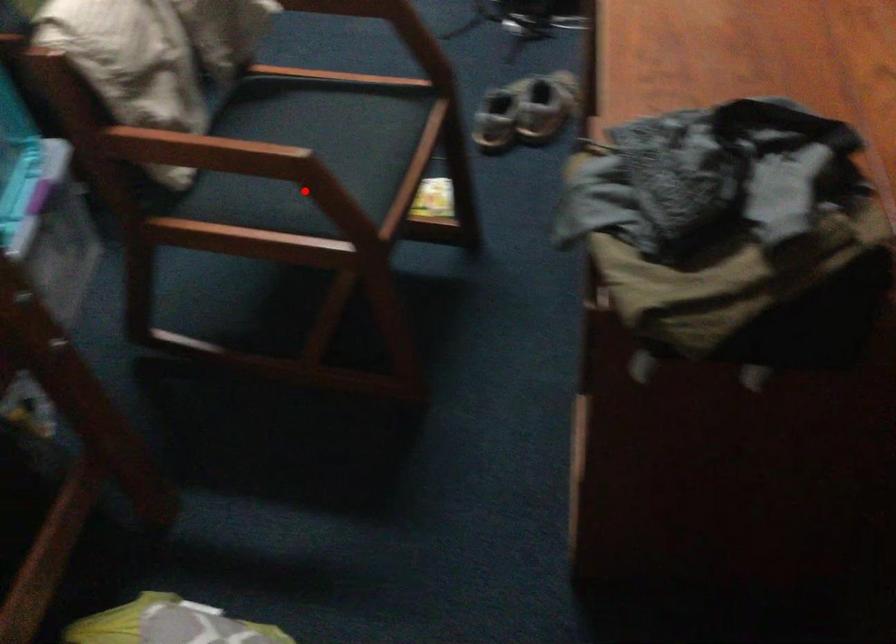
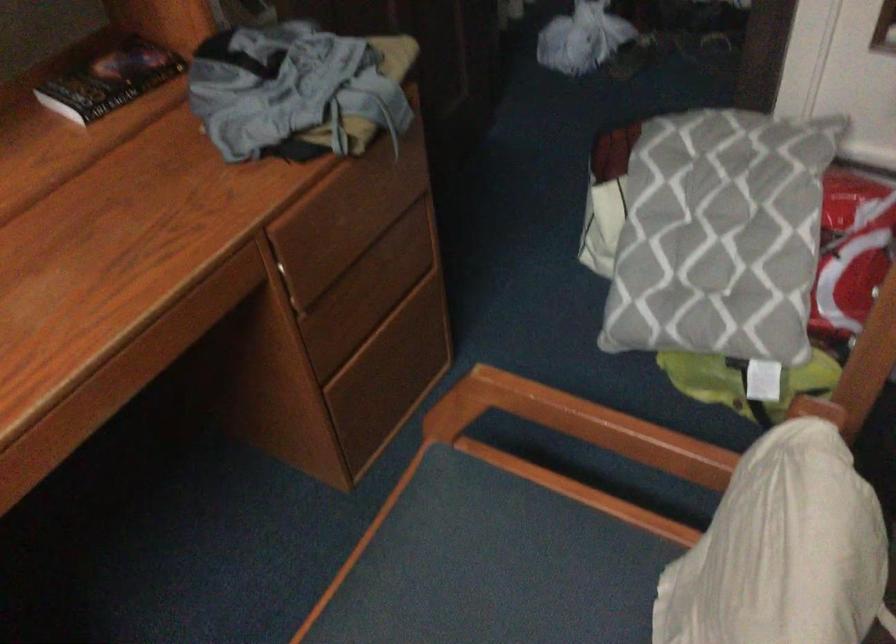
Question: I am providing you with two images of the same scene from different viewpoints. Image1 has a red point marked. In image2, the corresponding 3D location appears at what relative position? Reply with the corresponding letter.

Choices:
 (A) Closer
 (B) Farther

Answer: (A)